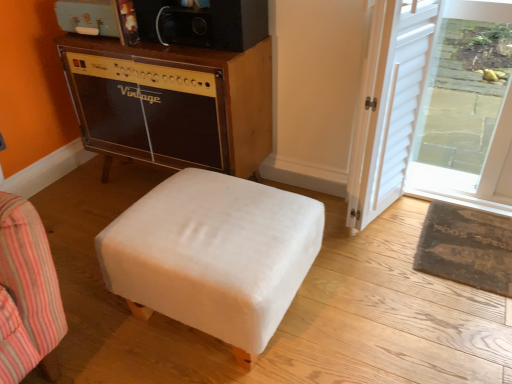
Question: Does transparent glass door at upper right have a greater width compared to white velvety ottoman at center?

Choices:
 (A) yes
 (B) no

Answer: (B)

Question: Is transparent glass door at upper right closer to the viewer compared to white velvety ottoman at center?

Choices:
 (A) yes
 (B) no

Answer: (B)

Question: Is transparent glass door at upper right not near white velvety ottoman at center?

Choices:
 (A) yes
 (B) no

Answer: (A)

Question: Is transparent glass door at upper right outside of white velvety ottoman at center?

Choices:
 (A) yes
 (B) no

Answer: (A)

Question: Considering the relative sizes of transparent glass door at upper right and white velvety ottoman at center in the image provided, is transparent glass door at upper right shorter than white velvety ottoman at center?

Choices:
 (A) yes
 (B) no

Answer: (B)

Question: Does transparent glass door at upper right have a lesser width compared to white velvety ottoman at center?

Choices:
 (A) yes
 (B) no

Answer: (A)

Question: Considering the relative positions of transparent glass door at upper right and rustic brown mat at lower right in the image provided, is transparent glass door at upper right to the right of rustic brown mat at lower right from the viewer's perspective?

Choices:
 (A) no
 (B) yes

Answer: (B)

Question: Does transparent glass door at upper right come behind rustic brown mat at lower right?

Choices:
 (A) yes
 (B) no

Answer: (B)

Question: Does transparent glass door at upper right contain rustic brown mat at lower right?

Choices:
 (A) yes
 (B) no

Answer: (B)

Question: Does transparent glass door at upper right have a larger size compared to rustic brown mat at lower right?

Choices:
 (A) no
 (B) yes

Answer: (B)

Question: From a real-world perspective, is transparent glass door at upper right on rustic brown mat at lower right?

Choices:
 (A) no
 (B) yes

Answer: (B)

Question: Is transparent glass door at upper right oriented away from rustic brown mat at lower right?

Choices:
 (A) yes
 (B) no

Answer: (B)

Question: Would you say rustic brown mat at lower right is outside transparent glass door at upper right?

Choices:
 (A) no
 (B) yes

Answer: (B)